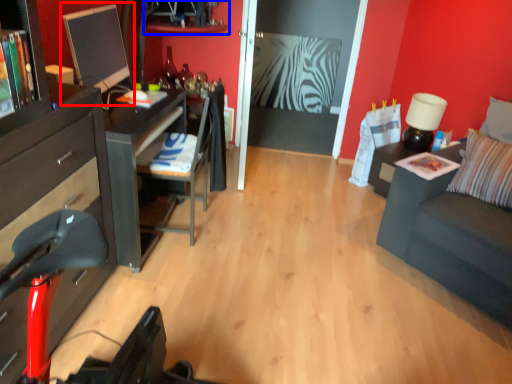
Question: Among these objects, which one is farthest to the camera, computer monitor (highlighted by a red box) or shelf (highlighted by a blue box)?

Choices:
 (A) computer monitor
 (B) shelf

Answer: (B)